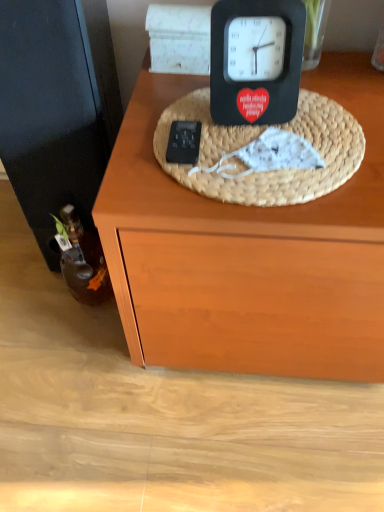
You are a GUI agent. You are given a task and a screenshot of the screen. Output one action in this format:
    pyautogui.click(x=<x>, y=<y>)
    Task: Click on the woven straw basket at center
    
    Given the screenshot: What is the action you would take?
    pyautogui.click(x=258, y=135)

Image resolution: width=384 pixels, height=512 pixels. Describe the element at coordinates (83, 261) in the screenshot. I see `brown glass bottle at left` at that location.

In order to click on woven straw basket at center in this screenshot , I will do `click(258, 135)`.

Considering the positions of objects black matte clock at upper center and brown glass bottle at left in the image provided, who is more to the right, black matte clock at upper center or brown glass bottle at left?

Positioned to the right is black matte clock at upper center.

Is black matte clock at upper center situated inside brown glass bottle at left or outside?

black matte clock at upper center exists outside the volume of brown glass bottle at left.

The width and height of the screenshot is (384, 512). I want to click on bottle located on the left of black matte clock at upper center, so click(x=83, y=261).

Relative to brown glass bottle at left, is black matte clock at upper center in front or behind?

In the image, black matte clock at upper center appears in front of brown glass bottle at left.

Between brown glass bottle at left and woven straw basket at center, which one has larger width?

Wider between the two is woven straw basket at center.

Is brown glass bottle at left closer to the viewer compared to woven straw basket at center?

No, it is not.

Is brown glass bottle at left next to woven straw basket at center?

No, brown glass bottle at left is not in contact with woven straw basket at center.

From the image's perspective, is woven straw basket at center above black matte clock at upper center?

No, from the image's perspective, woven straw basket at center is not above black matte clock at upper center.

Considering the positions of objects woven straw basket at center and black matte clock at upper center in the image provided, who is behind, woven straw basket at center or black matte clock at upper center?

black matte clock at upper center is behind.

Could black matte clock at upper center be considered to be inside woven straw basket at center?

No, black matte clock at upper center is not inside woven straw basket at center.

From a real-world perspective, is brown glass bottle at left below black matte clock at upper center?

Yes, from a real-world perspective, brown glass bottle at left is beneath black matte clock at upper center.

Based on the photo, which of these two, brown glass bottle at left or black matte clock at upper center, is thinner?

Thinner between the two is brown glass bottle at left.

Do you think brown glass bottle at left is within black matte clock at upper center, or outside of it?

brown glass bottle at left cannot be found inside black matte clock at upper center.

In the scene shown: Considering the relative positions of brown glass bottle at left and black matte clock at upper center in the image provided, is brown glass bottle at left to the left or to the right of black matte clock at upper center?

In the image, brown glass bottle at left appears on the left side of black matte clock at upper center.

Considering the relative sizes of woven straw basket at center and brown glass bottle at left in the image provided, is woven straw basket at center wider than brown glass bottle at left?

Correct, the width of woven straw basket at center exceeds that of brown glass bottle at left.

Between point (332, 113) and point (110, 285), which one is positioned in front?

The point (332, 113) is in front.

Considering the relative positions of woven straw basket at center and brown glass bottle at left in the image provided, is woven straw basket at center to the left or to the right of brown glass bottle at left?

In the image, woven straw basket at center appears on the right side of brown glass bottle at left.

Considering the sizes of woven straw basket at center and brown glass bottle at left in the image, is woven straw basket at center taller or shorter than brown glass bottle at left?

Considering their sizes, woven straw basket at center has less height than brown glass bottle at left.

Considering the positions of objects black matte clock at upper center and woven straw basket at center in the image provided, who is in front, black matte clock at upper center or woven straw basket at center?

woven straw basket at center is in front.

Does black matte clock at upper center turn towards woven straw basket at center?

Yes, black matte clock at upper center is oriented towards woven straw basket at center.

Considering the relative positions of black matte clock at upper center and woven straw basket at center in the image provided, is black matte clock at upper center to the right of woven straw basket at center from the viewer's perspective?

In fact, black matte clock at upper center is to the left of woven straw basket at center.

The height and width of the screenshot is (512, 384). What are the coordinates of `bottle behind the black matte clock at upper center` in the screenshot? It's located at (83, 261).

Locate an element on the screen. The image size is (384, 512). bottle located underneath the woven straw basket at center (from a real-world perspective) is located at coordinates (83, 261).

Based on the photo, which object lies further to the anchor point woven straw basket at center, brown glass bottle at left or black matte clock at upper center?

Based on the image, brown glass bottle at left appears to be further to woven straw basket at center.

Based on their spatial positions, is black matte clock at upper center or woven straw basket at center further from brown glass bottle at left?

black matte clock at upper center.

Estimate the real-world distances between objects in this image. Which object is further from black matte clock at upper center, brown glass bottle at left or woven straw basket at center?

brown glass bottle at left.

Estimate the real-world distances between objects in this image. Which object is further from brown glass bottle at left, woven straw basket at center or black matte clock at upper center?

black matte clock at upper center is positioned further to the anchor brown glass bottle at left.

Considering their positions, is woven straw basket at center positioned further to black matte clock at upper center than brown glass bottle at left?

Based on the image, brown glass bottle at left appears to be further to black matte clock at upper center.

Which object lies further to the anchor point woven straw basket at center, black matte clock at upper center or brown glass bottle at left?

brown glass bottle at left lies further to woven straw basket at center than the other object.

You are a GUI agent. You are given a task and a screenshot of the screen. Output one action in this format:
    pyautogui.click(x=<x>, y=<y>)
    Task: Click on the clock between brown glass bottle at left and woven straw basket at center
    The width and height of the screenshot is (384, 512).
    Given the screenshot: What is the action you would take?
    pyautogui.click(x=256, y=61)